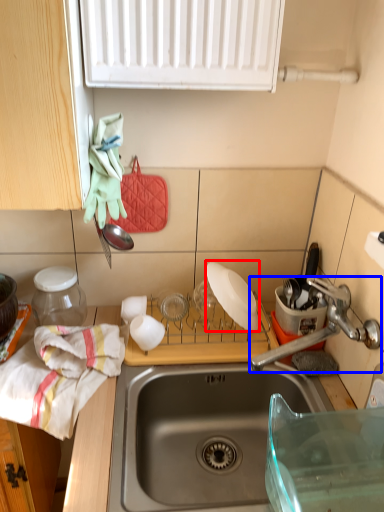
Question: Among these objects, which one is farthest to the camera, appliance (highlighted by a red box) or tap (highlighted by a blue box)?

Choices:
 (A) appliance
 (B) tap

Answer: (A)